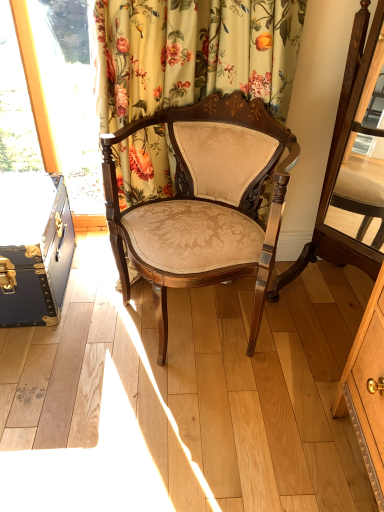
Where is `free space in front of floral fabric curtain at upper center`? The height and width of the screenshot is (512, 384). free space in front of floral fabric curtain at upper center is located at coordinates (195, 388).